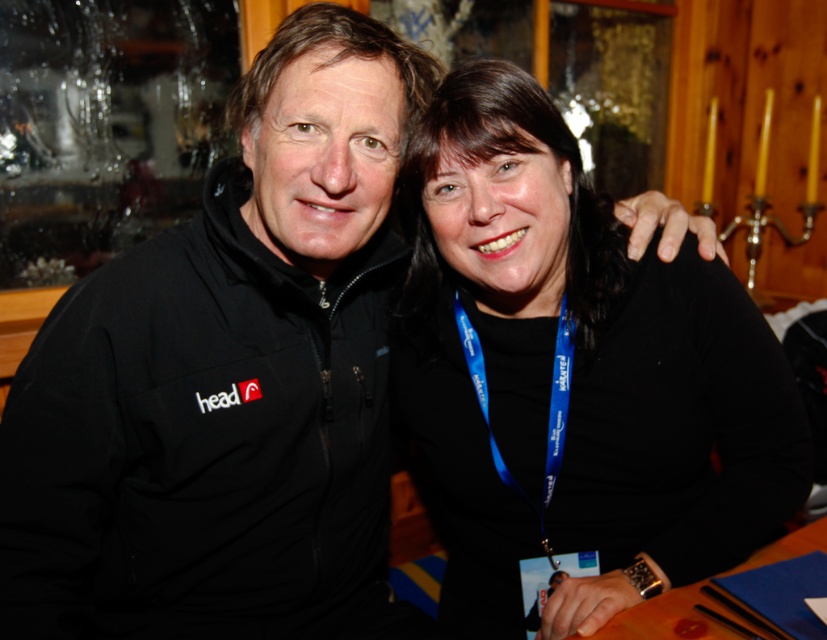
You are a server at a restaurant and need to place a 12 inch long dessert plate between the wooden table at lower right and the blue fabric lanyard at lower center. Will the plate fit between them?

The wooden table at lower right and blue fabric lanyard at lower center are 10.04 inches apart, so the 12 inch dessert plate will not fit between them as the space is smaller than the plate.

You are standing in the venue and want to reach a specific point in the image. The point is located at coordinates point (741,484). If you can move forward 1 meter, will you be able to reach that point?

The distance of point (741,484) from viewer is 1.08 meters. Moving forward 1 meter would bring you to 1 meter, which is still 0.08 meters short of reaching the point. Therefore, you will not be able to reach it.